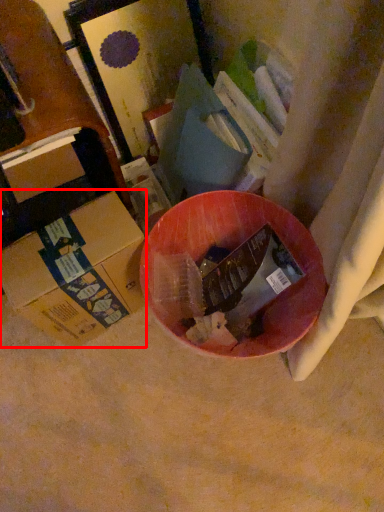
Question: From the image's perspective, where is box (annotated by the red box) located relative to box?

Choices:
 (A) below
 (B) above

Answer: (A)